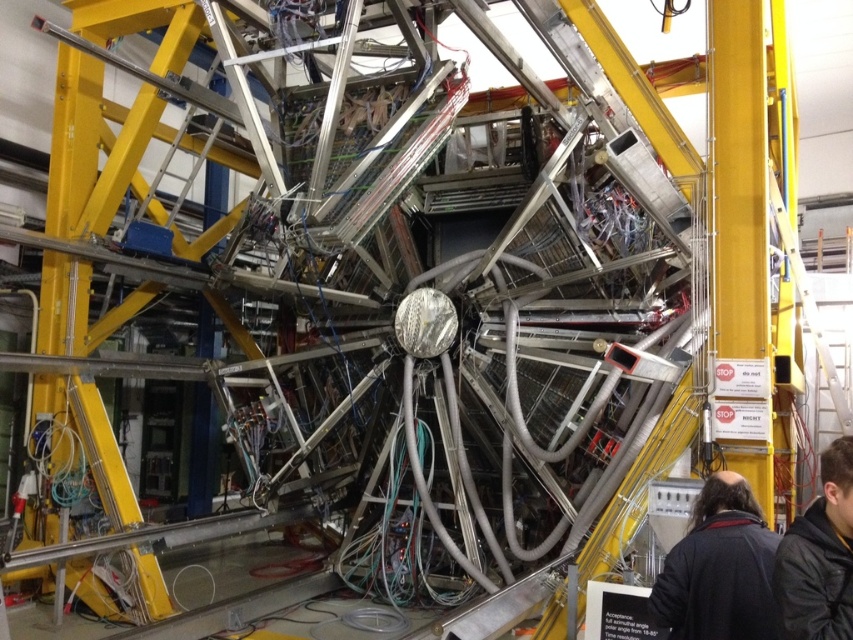
The image size is (853, 640). What are the coordinates of `yellow metallic ladder at left` in the screenshot? It's located at (96, 148).

Between point (45, 289) and point (735, 548), which one is positioned behind?

The point (45, 289) is behind.

Does point (84, 17) lie behind point (711, 548)?

Yes, point (84, 17) is farther from viewer.

Locate an element on the screen. This screenshot has width=853, height=640. yellow metallic ladder at left is located at coordinates (96, 148).

Can you confirm if dark brown leather jacket at lower right is thinner than black jacket at lower right?

No, dark brown leather jacket at lower right is not thinner than black jacket at lower right.

Which of these two, dark brown leather jacket at lower right or black jacket at lower right, stands taller?

Standing taller between the two is black jacket at lower right.

Which is behind, point (747, 586) or point (840, 531)?

The point (747, 586) is more distant.

You are a GUI agent. You are given a task and a screenshot of the screen. Output one action in this format:
    pyautogui.click(x=<x>, y=<y>)
    Task: Click on the dark brown leather jacket at lower right
    This screenshot has height=640, width=853.
    Given the screenshot: What is the action you would take?
    pyautogui.click(x=718, y=568)

Which is more to the left, yellow metallic ladder at left or black jacket at lower right?

Positioned to the left is yellow metallic ladder at left.

Who is positioned more to the right, yellow metallic ladder at left or black jacket at lower right?

black jacket at lower right is more to the right.

Between point (97, 474) and point (817, 625), which one is positioned behind?

The point (97, 474) is more distant.

Image resolution: width=853 pixels, height=640 pixels. In order to click on yellow metallic ladder at left in this screenshot , I will do `click(96, 148)`.